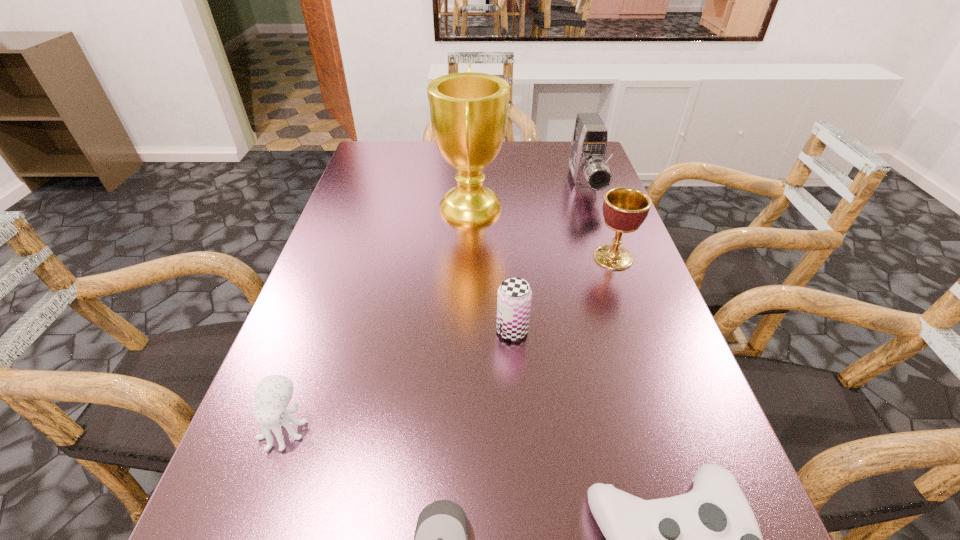
Locate an element on the screen. This screenshot has height=540, width=960. vacant region located 0.390m on the left of the beer can is located at coordinates (294, 330).

The height and width of the screenshot is (540, 960). What are the coordinates of `vacant region located 0.070m on the front-facing side of the octopus` in the screenshot? It's located at (257, 502).

The height and width of the screenshot is (540, 960). Identify the location of award located at the far edge. (469, 111).

Locate an element on the screen. The width and height of the screenshot is (960, 540). camcorder present at the far edge is located at coordinates (590, 172).

Where is `object at the left edge`? The image size is (960, 540). object at the left edge is located at coordinates (273, 394).

Where is `camcorder at the right edge`? This screenshot has height=540, width=960. camcorder at the right edge is located at coordinates (590, 172).

This screenshot has width=960, height=540. I want to click on chalice situated at the right edge, so click(624, 209).

The image size is (960, 540). I want to click on object that is at the far right corner, so click(590, 172).

Locate an element on the screen. Image resolution: width=960 pixels, height=540 pixels. blank area at the far edge is located at coordinates (428, 158).

Locate an element on the screen. This screenshot has height=540, width=960. free location at the left edge of the desktop is located at coordinates (304, 292).